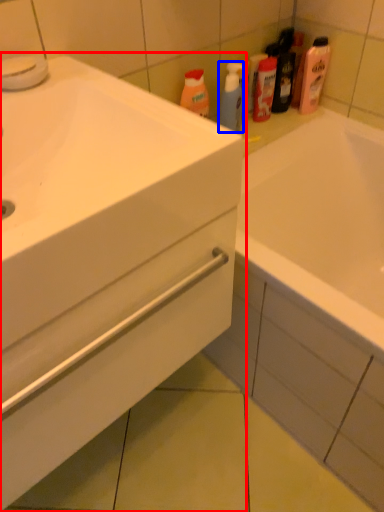
Question: Among these objects, which one is nearest to the camera, bathroom cabinet (highlighted by a red box) or cleaning product (highlighted by a blue box)?

Choices:
 (A) bathroom cabinet
 (B) cleaning product

Answer: (A)